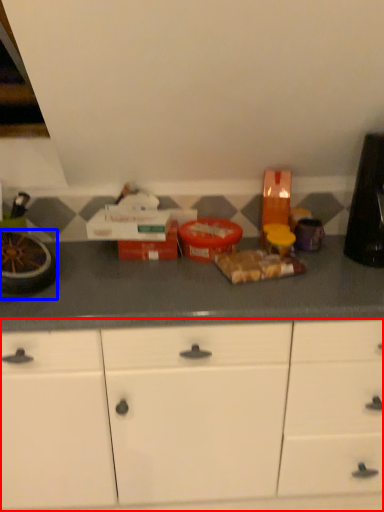
Question: Which point is closer to the camera, cabinetry (highlighted by a red box) or appliance (highlighted by a blue box)?

Choices:
 (A) cabinetry
 (B) appliance

Answer: (A)